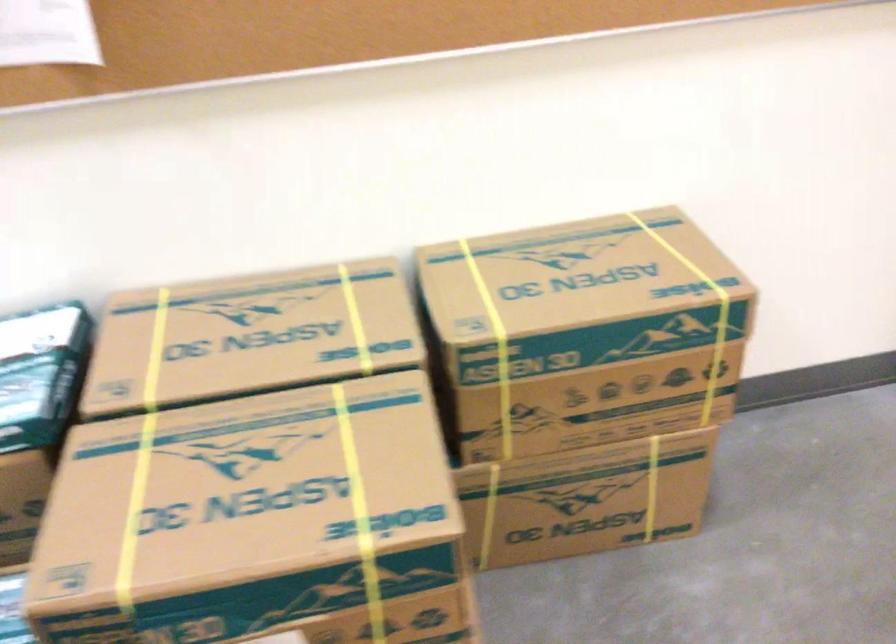
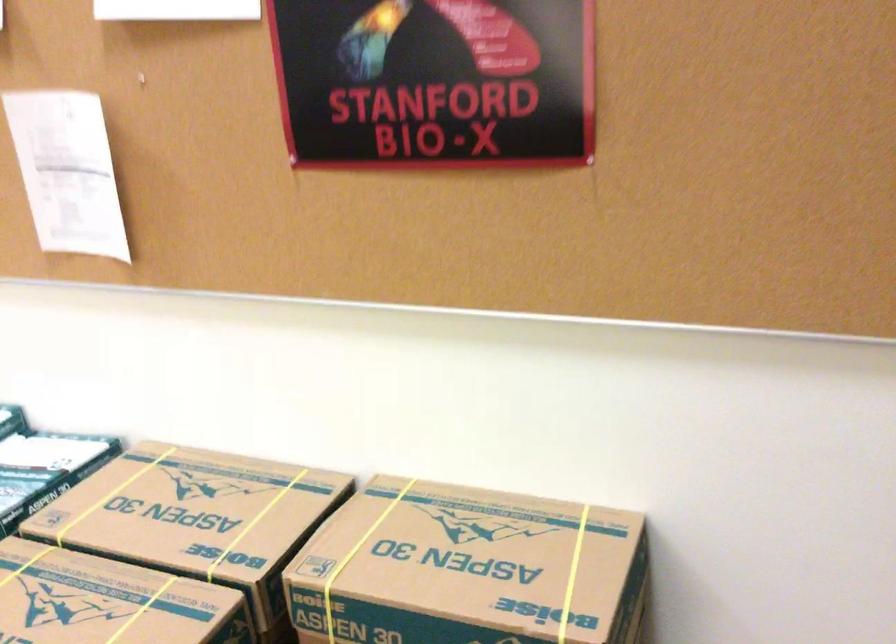
Question: Based on the continuous images, in which direction is the camera rotating? Reply with the corresponding letter.

Choices:
 (A) Left
 (B) Right
 (C) Up
 (D) Down

Answer: (A)